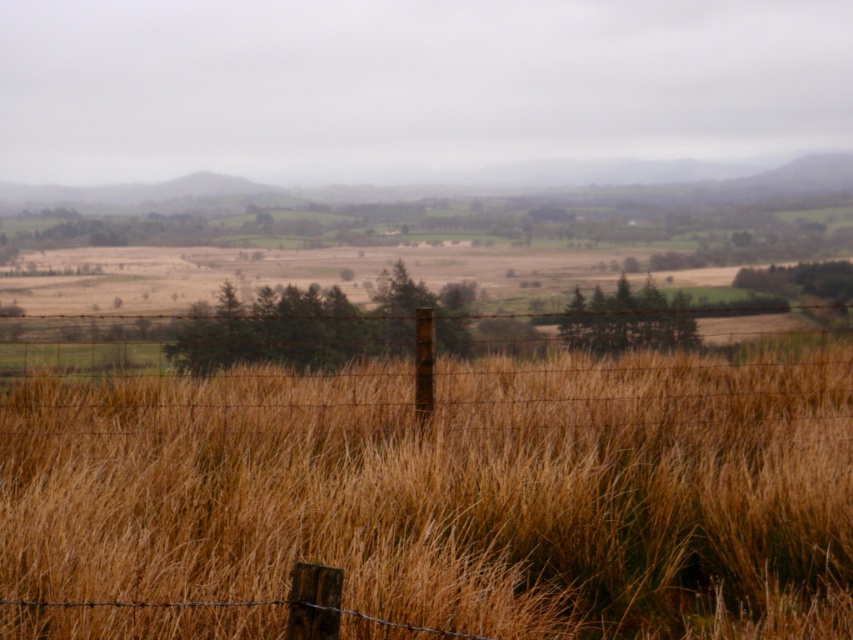
What are the exact coordinates of the brown dry grass at center in the image?

The brown dry grass at center is located at coordinates point (451,492).

You are a farmer checking the height of the brown dry grass at center and the barbed wire fence at center in your field. Which one is taller?

The barbed wire fence at center is taller than the brown dry grass at center.